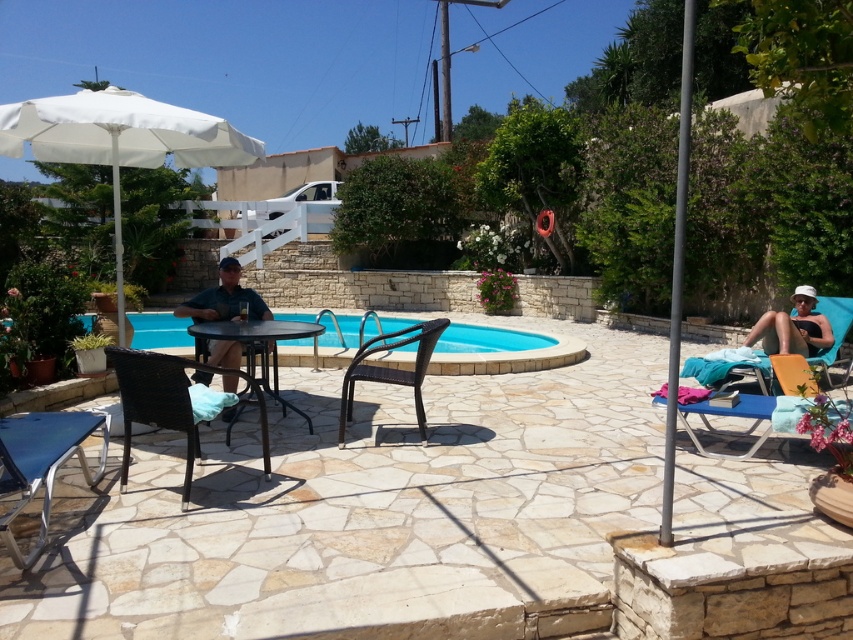
You are standing at the edge of the swimming pool and want to walk to the point marked as point (x=467, y=358). There is an obstacle at point (x=264, y=468). Will you need to go around the obstacle to reach your destination?

Point (x=467, y=358) is further to the viewer than point (x=264, y=468), so you will not need to go around the obstacle because the destination is closer to you than the obstacle.

You are a guest at this patio and want to sit down comfortably. The woven brown chair at lower left and the matte black shirt at center are both available. Which one is taller and thus might be more comfortable for sitting?

The woven brown chair at lower left is taller than the matte black shirt at center, so it might be more comfortable for sitting.

You are planning to place a new small decorative item on the woven brown chair at lower left and the matte black shirt at center. Considering their sizes, which object would allow the decorative item to be more visible?

The woven brown chair at lower left has a larger size compared to matte black shirt at center, so placing the decorative item on the woven brown chair at lower left would make it more visible.